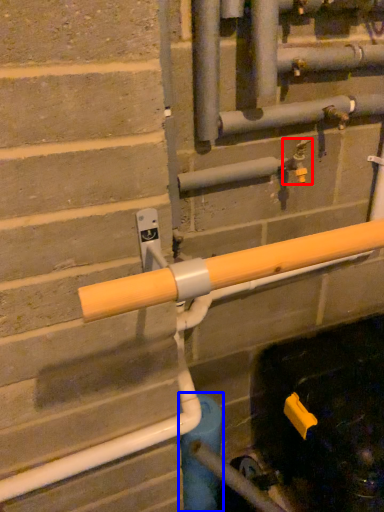
Question: Which object appears farthest to the camera in this image, plumbing fixture (highlighted by a red box) or water pipe (highlighted by a blue box)?

Choices:
 (A) plumbing fixture
 (B) water pipe

Answer: (B)